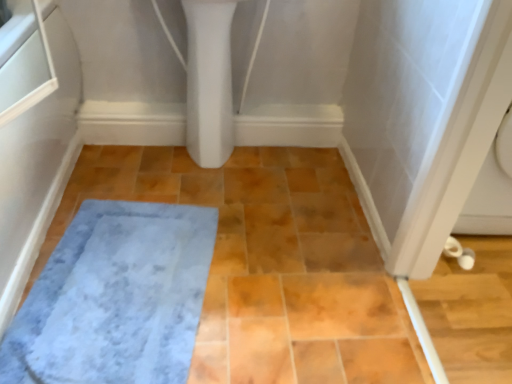
Question: Is gray plush bath mat at lower left at the back of white glossy bidet at upper center?

Choices:
 (A) no
 (B) yes

Answer: (A)

Question: Is white glossy bidet at upper center smaller than gray plush bath mat at lower left?

Choices:
 (A) yes
 (B) no

Answer: (B)

Question: Considering the relative positions of white glossy bidet at upper center and gray plush bath mat at lower left in the image provided, is white glossy bidet at upper center behind gray plush bath mat at lower left?

Choices:
 (A) yes
 (B) no

Answer: (A)

Question: Does white glossy bidet at upper center have a greater width compared to gray plush bath mat at lower left?

Choices:
 (A) yes
 (B) no

Answer: (B)

Question: Can you confirm if white glossy bidet at upper center is shorter than gray plush bath mat at lower left?

Choices:
 (A) yes
 (B) no

Answer: (B)

Question: From the image's perspective, is white glossy bidet at upper center beneath gray plush bath mat at lower left?

Choices:
 (A) no
 (B) yes

Answer: (A)

Question: Is gray plush bath mat at lower left positioned with its back to white glossy bidet at upper center?

Choices:
 (A) yes
 (B) no

Answer: (B)

Question: From the image's perspective, is gray plush bath mat at lower left on white glossy bidet at upper center?

Choices:
 (A) no
 (B) yes

Answer: (A)

Question: Is gray plush bath mat at lower left in front of white glossy bidet at upper center?

Choices:
 (A) yes
 (B) no

Answer: (A)

Question: Is gray plush bath mat at lower left shorter than white glossy bidet at upper center?

Choices:
 (A) no
 (B) yes

Answer: (B)

Question: Are gray plush bath mat at lower left and white glossy bidet at upper center located far from each other?

Choices:
 (A) no
 (B) yes

Answer: (A)

Question: Is gray plush bath mat at lower left at the right side of white glossy bidet at upper center?

Choices:
 (A) yes
 (B) no

Answer: (B)

Question: From the image's perspective, is gray plush bath mat at lower left positioned above or below white glossy bidet at upper center?

Choices:
 (A) below
 (B) above

Answer: (A)